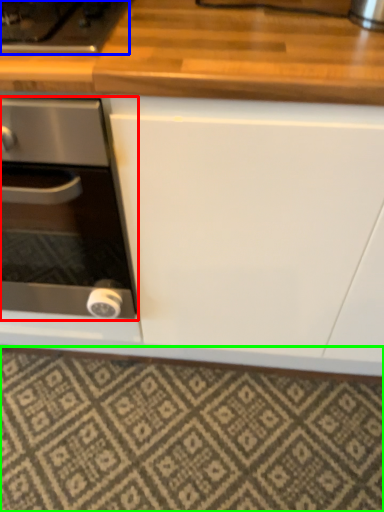
Question: Estimate the real-world distances between objects in this image. Which object is closer to kitchen appliance (highlighted by a red box), gas stove (highlighted by a blue box) or tile (highlighted by a green box)?

Choices:
 (A) gas stove
 (B) tile

Answer: (A)